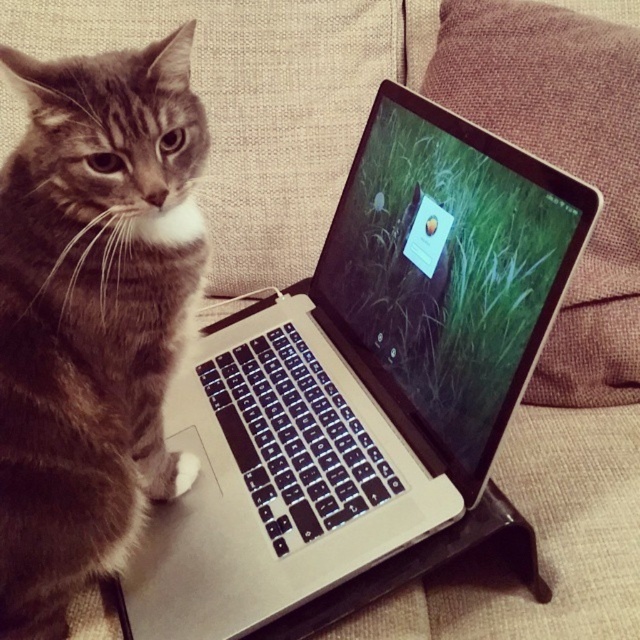
Question: Among these objects, which one is nearest to the camera?

Choices:
 (A) matte black screen at center
 (B) tabby fur cat at left
 (C) silver metallic laptop at center

Answer: (C)

Question: Which point appears closest to the camera in this image?

Choices:
 (A) pos(552,310)
 (B) pos(595,176)
 (C) pos(195,280)

Answer: (A)

Question: Is silver metallic laptop at center wider than tabby fur cat at left?

Choices:
 (A) no
 (B) yes

Answer: (B)

Question: Which point is closer to the camera?

Choices:
 (A) (140, 202)
 (B) (624, 189)
 (C) (404, 358)

Answer: (A)

Question: Can you confirm if silver metallic laptop at center is positioned to the right of matte black screen at center?

Choices:
 (A) no
 (B) yes

Answer: (A)

Question: Does silver metallic laptop at center have a smaller size compared to tabby fur cat at left?

Choices:
 (A) yes
 (B) no

Answer: (B)